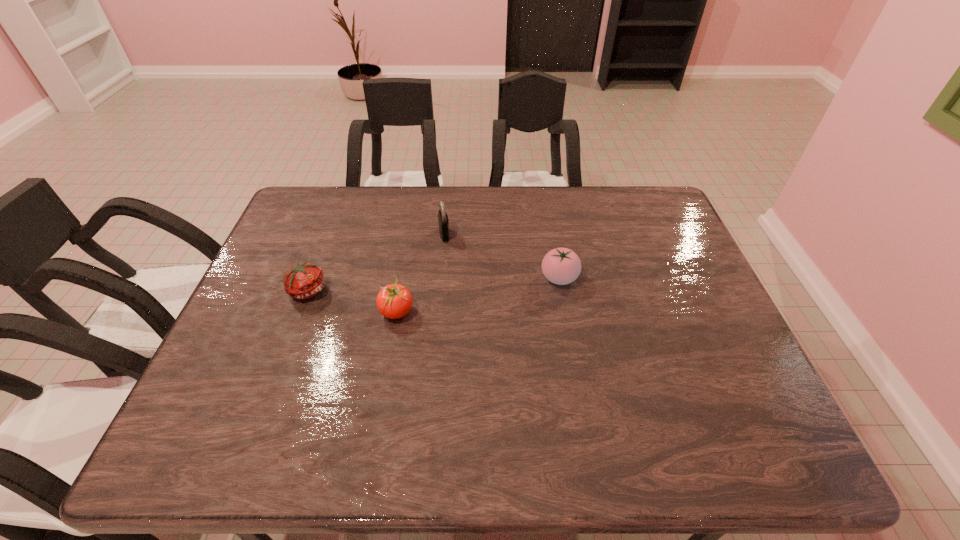
The image size is (960, 540). I want to click on object that is at the left edge, so tap(305, 280).

Where is `vacant space at the far edge of the desktop`? This screenshot has width=960, height=540. vacant space at the far edge of the desktop is located at coordinates pos(577,224).

Locate an element on the screen. The width and height of the screenshot is (960, 540). vacant space at the near edge of the desktop is located at coordinates (633, 428).

Find the location of a particular element. Image resolution: width=960 pixels, height=540 pixels. free space at the left edge is located at coordinates (248, 304).

The image size is (960, 540). I want to click on vacant space at the right edge of the desktop, so click(715, 343).

At what (x,y) coordinates should I click in order to perform the action: click on free point at the far right corner. Please return your answer as a coordinate pair (x, y). This screenshot has height=540, width=960. Looking at the image, I should click on (627, 192).

You are a GUI agent. You are given a task and a screenshot of the screen. Output one action in this format:
    pyautogui.click(x=<x>, y=<y>)
    Task: Click on the free space between the rightmost tomato and the leftmost tomato
    This screenshot has width=960, height=540.
    Given the screenshot: What is the action you would take?
    pyautogui.click(x=434, y=284)

This screenshot has width=960, height=540. Identify the location of free area in between the rightmost tomato and the second object from right to left. (502, 256).

Locate an element on the screen. The width and height of the screenshot is (960, 540). unoccupied position between the tallest object and the second tomato from left to right is located at coordinates (420, 273).

Locate an element on the screen. free space between the tallest object and the rightmost object is located at coordinates (502, 256).